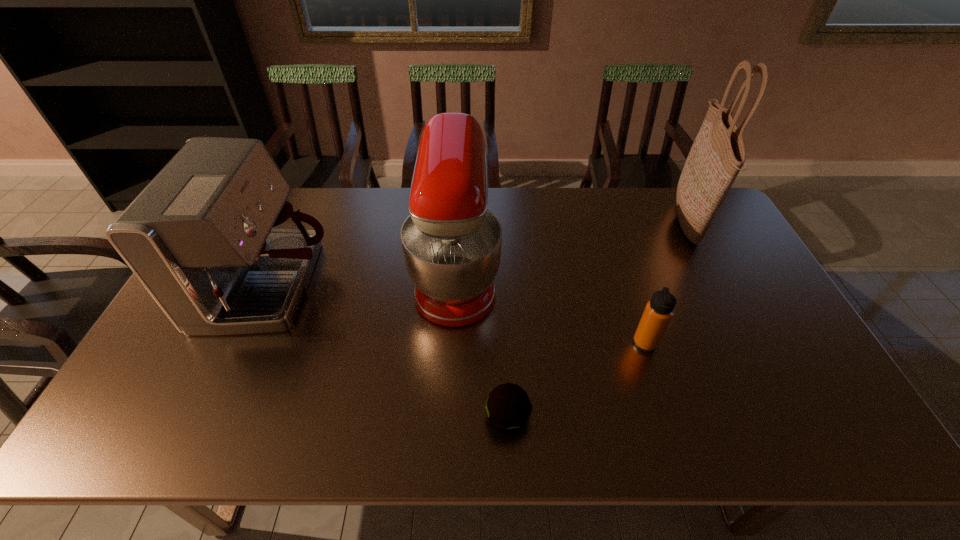
Locate an element on the screen. shopping bag is located at coordinates (718, 153).

In order to click on the tallest object in this screenshot , I will do `click(718, 153)`.

Identify the location of mixer. Image resolution: width=960 pixels, height=540 pixels. (451, 243).

You are a GUI agent. You are given a task and a screenshot of the screen. Output one action in this format:
    pyautogui.click(x=<x>, y=<y>)
    Task: Click on the coffee maker
    This screenshot has width=960, height=540.
    Given the screenshot: What is the action you would take?
    pyautogui.click(x=212, y=238)

Locate an element on the screen. the fourth tallest object is located at coordinates (658, 312).

Find the location of `thermos bottle`. thermos bottle is located at coordinates pos(658,312).

You are a GUI agent. You are given a task and a screenshot of the screen. Output one action in this format:
    pyautogui.click(x=<x>, y=<y>)
    Task: Click on the patty
    The image size is (960, 540).
    Given the screenshot: What is the action you would take?
    coord(508,407)

You are a GUI agent. You are given a task and a screenshot of the screen. Output one action in this format:
    pyautogui.click(x=<x>, y=<y>)
    Task: Click on the shortest object
    The height and width of the screenshot is (540, 960).
    Given the screenshot: What is the action you would take?
    pyautogui.click(x=508, y=407)

This screenshot has height=540, width=960. What are the coordinates of `vacant space located 0.140m on the left of the rightmost object` in the screenshot? It's located at (630, 222).

The image size is (960, 540). I want to click on free spot located 0.360m on the front-facing side of the mixer, so click(x=616, y=274).